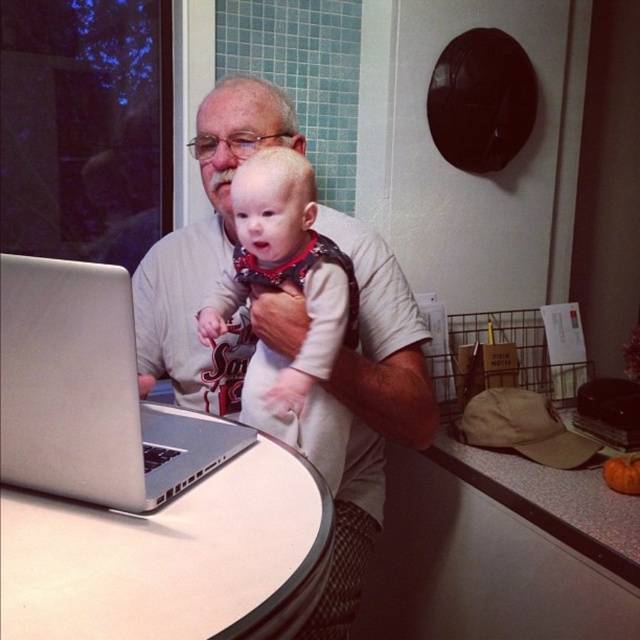
Question: Which of these objects is positioned farthest from the matte white baby at center?

Choices:
 (A) matte white shirt at center
 (B) white laminate table at center
 (C) silver metallic laptop at left
 (D) speckled laminate counter top at lower right

Answer: (D)

Question: Does white laminate table at center have a lesser width compared to silver metallic laptop at left?

Choices:
 (A) yes
 (B) no

Answer: (B)

Question: Can you confirm if white laminate table at center is positioned to the left of silver metallic laptop at left?

Choices:
 (A) yes
 (B) no

Answer: (B)

Question: Is white laminate table at center to the left of matte white shirt at center from the viewer's perspective?

Choices:
 (A) yes
 (B) no

Answer: (A)

Question: Among these objects, which one is nearest to the camera?

Choices:
 (A) white laminate table at center
 (B) matte white shirt at center
 (C) speckled laminate counter top at lower right
 (D) matte white baby at center

Answer: (A)

Question: Based on their relative distances, which object is farther from the speckled laminate counter top at lower right?

Choices:
 (A) silver metallic laptop at left
 (B) white laminate table at center
 (C) matte white baby at center
 (D) matte white shirt at center

Answer: (A)